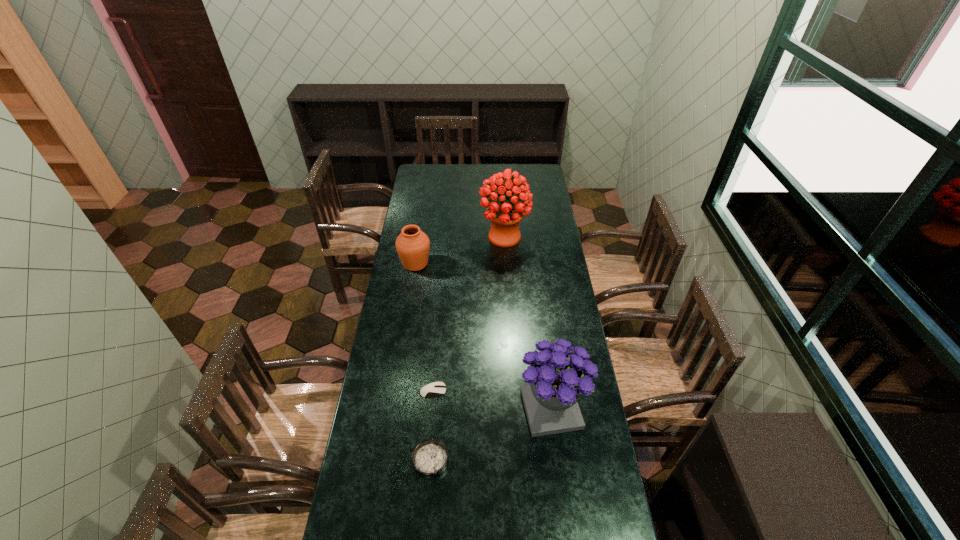
Where is `the farther bouquet`? This screenshot has height=540, width=960. the farther bouquet is located at coordinates (505, 214).

At what (x,y) coordinates should I click in order to perform the action: click on the tallest object. Please return your answer as a coordinate pair (x, y). This screenshot has width=960, height=540. Looking at the image, I should click on (505, 214).

I want to click on the nearer bouquet, so click(x=557, y=378).

The width and height of the screenshot is (960, 540). I want to click on the shorter bouquet, so click(557, 378).

At what (x,y) coordinates should I click in order to perform the action: click on urn. Please return your answer as a coordinate pair (x, y). The width and height of the screenshot is (960, 540). Looking at the image, I should click on (412, 245).

The height and width of the screenshot is (540, 960). In order to click on the third tallest object in this screenshot , I will do `click(412, 245)`.

At what (x,y) coordinates should I click in order to perform the action: click on mouse. Please return your answer as a coordinate pair (x, y). The image size is (960, 540). Looking at the image, I should click on point(435,389).

I want to click on the nearest object, so coord(430,458).

At what (x,y) coordinates should I click in order to perform the action: click on vacant space situated 0.070m on the left of the tallest object. Please return your answer as a coordinate pair (x, y). This screenshot has width=960, height=540. Looking at the image, I should click on (466, 237).

The image size is (960, 540). What are the coordinates of `free region located on the left of the nearer bouquet` in the screenshot? It's located at point(435,409).